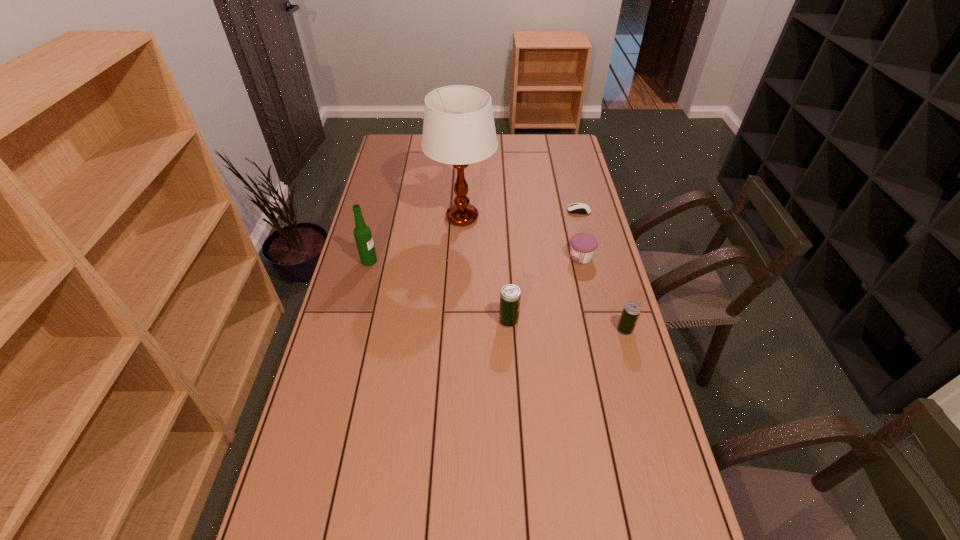
The image size is (960, 540). Identify the location of free space in the image that satisfies the following two spatial constraints: 1. on the label of the leftmost object; 2. on the right side of the third tallest object. (354, 321).

Where is `free location that satisfies the following two spatial constraints: 1. on the label of the leftmost object; 2. on the back side of the left beer can`? Image resolution: width=960 pixels, height=540 pixels. free location that satisfies the following two spatial constraints: 1. on the label of the leftmost object; 2. on the back side of the left beer can is located at coordinates (354, 321).